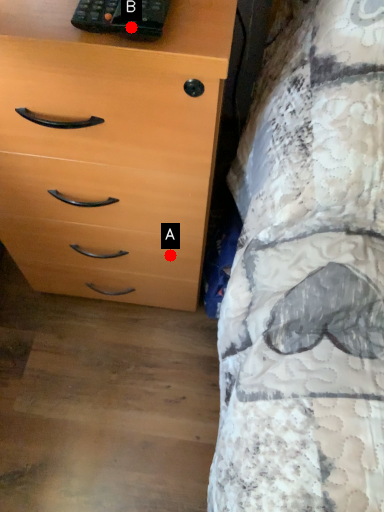
Question: Two points are circled on the image, labeled by A and B beside each circle. Which point is closer to the camera taking this photo?

Choices:
 (A) A is closer
 (B) B is closer

Answer: (B)